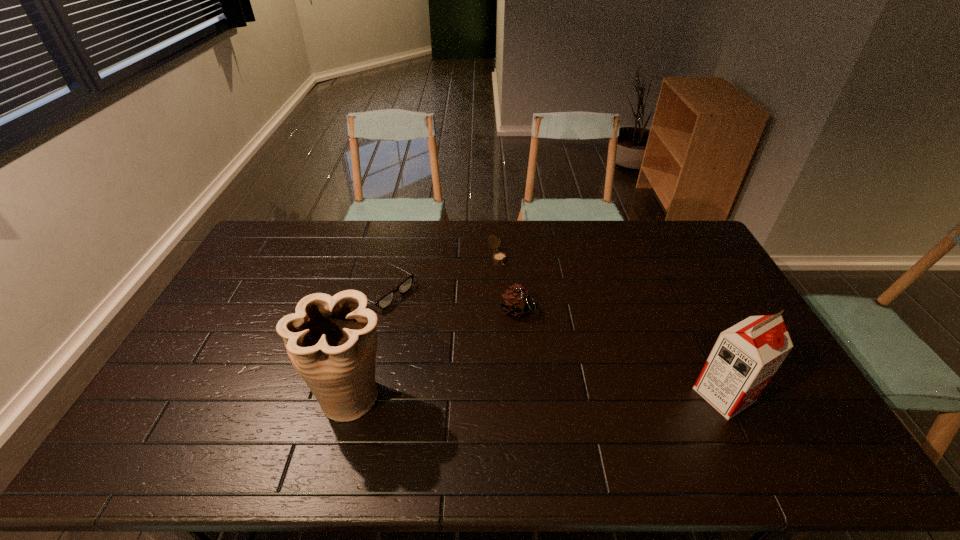
You are a GUI agent. You are given a task and a screenshot of the screen. Output one action in this format:
    pyautogui.click(x=<x>, y=<y>)
    Task: Click on the vacant space in between the farthest object and the spectacles
    This screenshot has height=540, width=960.
    Given the screenshot: What is the action you would take?
    pyautogui.click(x=440, y=274)

In order to click on free space between the third tallest object and the spectacles in this screenshot , I will do `click(450, 300)`.

You are a GUI agent. You are given a task and a screenshot of the screen. Output one action in this format:
    pyautogui.click(x=<x>, y=<y>)
    Task: Click on the blank region between the urn and the pinecone
    The height and width of the screenshot is (540, 960).
    Given the screenshot: What is the action you would take?
    pyautogui.click(x=435, y=353)

This screenshot has width=960, height=540. What are the coordinates of `vacant area that lies between the third shortest object and the fourth tallest object` in the screenshot? It's located at (507, 284).

This screenshot has height=540, width=960. I want to click on free spot between the urn and the soya milk, so click(x=538, y=395).

At what (x,y) coordinates should I click in order to perform the action: click on free space that is in between the soya milk and the farthest object. Please return your answer as a coordinate pair (x, y). This screenshot has width=960, height=540. Looking at the image, I should click on pyautogui.click(x=611, y=326).

You are a GUI agent. You are given a task and a screenshot of the screen. Output one action in this format:
    pyautogui.click(x=<x>, y=<y>)
    Task: Click on the unoccupied position between the shortest object and the pinecone
    
    Given the screenshot: What is the action you would take?
    pyautogui.click(x=450, y=300)

Find the location of a particular element. The image size is (960, 540). vacant space that's between the third shortest object and the compass is located at coordinates (507, 284).

This screenshot has width=960, height=540. Find the location of `object that is the second closest to the rightmost object`. object that is the second closest to the rightmost object is located at coordinates (499, 257).

The image size is (960, 540). I want to click on object that ranks as the fourth closest to the fourth tallest object, so click(x=745, y=357).